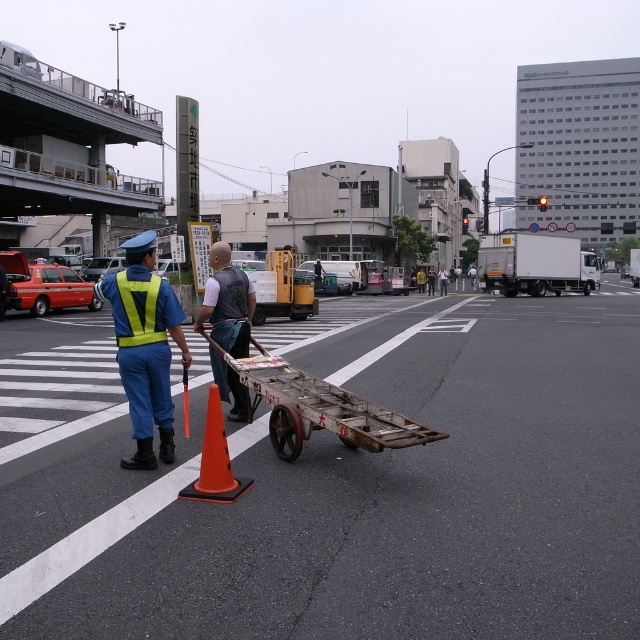
You are a pedestrian trying to cross the street safely. You see the reflective yellow vest at center and the rusty metal cart at center. Which object should you avoid stepping on to stay safe?

The rusty metal cart at center is on the right side of the reflective yellow vest at center. Since the cart is on the road, you should avoid stepping on it to stay safe.

Based on the scene description, where is the gray fabric shirt at center located in terms of coordinates?

The gray fabric shirt at center is located at coordinates point [227,301].

You are a pedestrian trying to cross the street and see the reflective yellow vest at center and the gray fabric shirt at center. Which one is bigger in size?

The reflective yellow vest at center is larger in size than the gray fabric shirt at center.